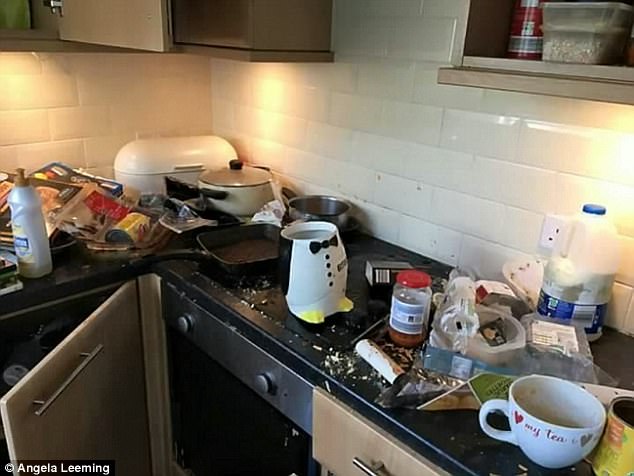
This screenshot has width=634, height=476. Identify the location of stove. (266, 304).